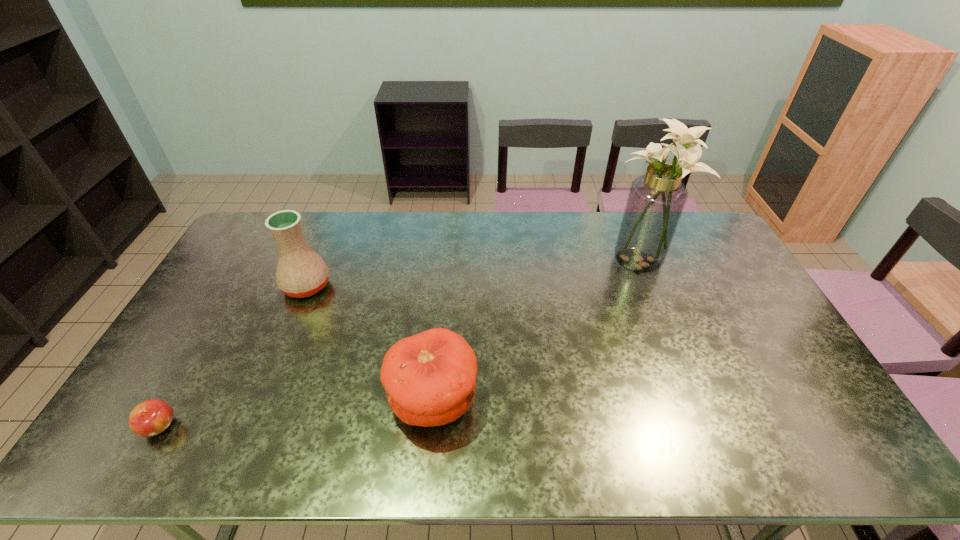
You are a GUI agent. You are given a task and a screenshot of the screen. Output one action in this format:
    pyautogui.click(x=<x>, y=<y>)
    Task: Click on the blank region between the rightmost object and the pottery
    The width and height of the screenshot is (960, 540).
    Given the screenshot: What is the action you would take?
    pyautogui.click(x=472, y=273)

The width and height of the screenshot is (960, 540). In order to click on object that ranks as the closest to the flower arrangement in this screenshot , I will do `click(429, 378)`.

Locate an element on the screen. object that is the closest to the second object from left to right is located at coordinates (429, 378).

This screenshot has width=960, height=540. What are the coordinates of `vacant area in the image that satisfies the following two spatial constraints: 1. on the front side of the third shortest object; 2. on the left side of the pumpkin` in the screenshot? It's located at (259, 400).

This screenshot has height=540, width=960. What are the coordinates of `free location that satisfies the following two spatial constraints: 1. on the back side of the leftmost object; 2. on the right side of the pottery` in the screenshot? It's located at (240, 286).